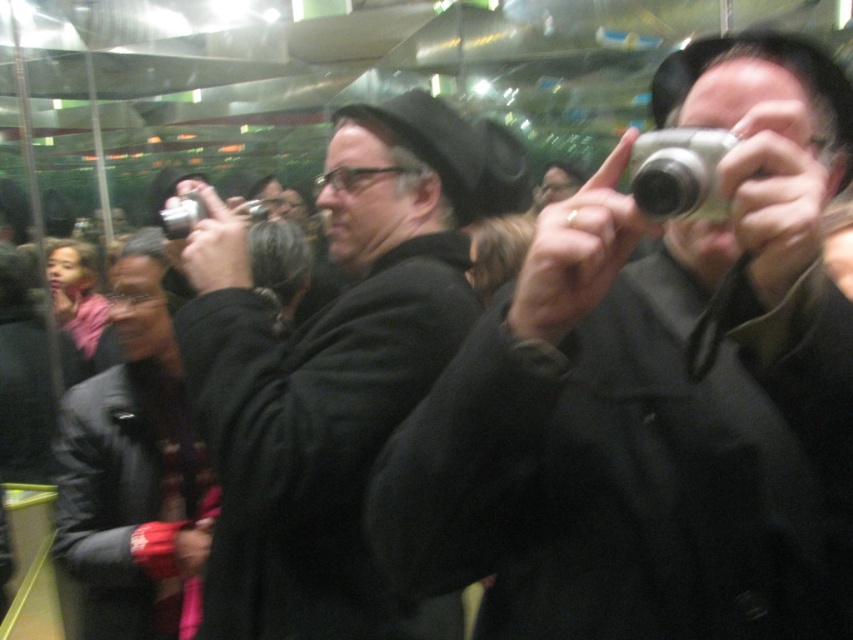
You are a photographer at the event and want to adjust your camera settings to focus on the black matte coat at center. Since the silver metallic camera at upper center is in the way, can you move it out of the way to get a clear shot?

The black matte coat at center is closer to the viewer than the silver metallic camera at upper center, so you don not need to move the silver metallic camera at upper center to focus on the black matte coat at center because it is already in front.